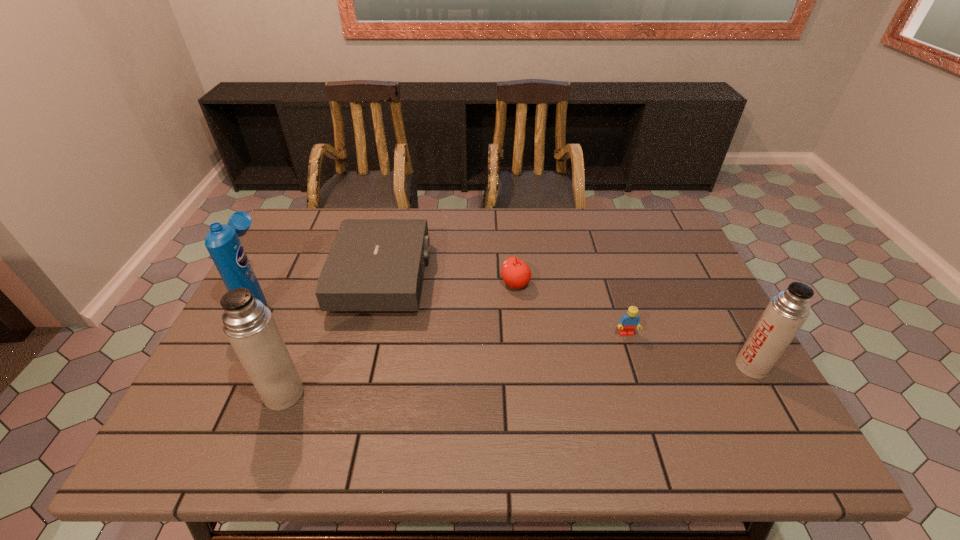
Identify the location of vacant area situated 0.280m on the front-facing side of the projector. (526, 277).

Where is `vacant space located on the face of the second object from right to left`? vacant space located on the face of the second object from right to left is located at coordinates (647, 397).

At what (x,y) coordinates should I click in order to perform the action: click on blank area located 0.350m on the right of the shampoo. Please return your answer as a coordinate pair (x, y). Image resolution: width=960 pixels, height=540 pixels. Looking at the image, I should click on (401, 301).

Identify the location of vacant space located on the front of the apple. (520, 337).

Locate an element on the screen. object that is at the far edge is located at coordinates (374, 264).

Find the location of `thermos bottle that is at the left edge`. thermos bottle that is at the left edge is located at coordinates (249, 325).

Locate an element on the screen. Image resolution: width=960 pixels, height=540 pixels. shampoo positioned at the left edge is located at coordinates (222, 241).

Locate an element on the screen. Image resolution: width=960 pixels, height=540 pixels. object present at the right edge is located at coordinates (786, 313).

At what (x,y) coordinates should I click in order to perform the action: click on object located in the near left corner section of the desktop. Please return your answer as a coordinate pair (x, y). This screenshot has height=540, width=960. Looking at the image, I should click on (249, 325).

Find the location of `object that is at the near right corner`. object that is at the near right corner is located at coordinates (786, 313).